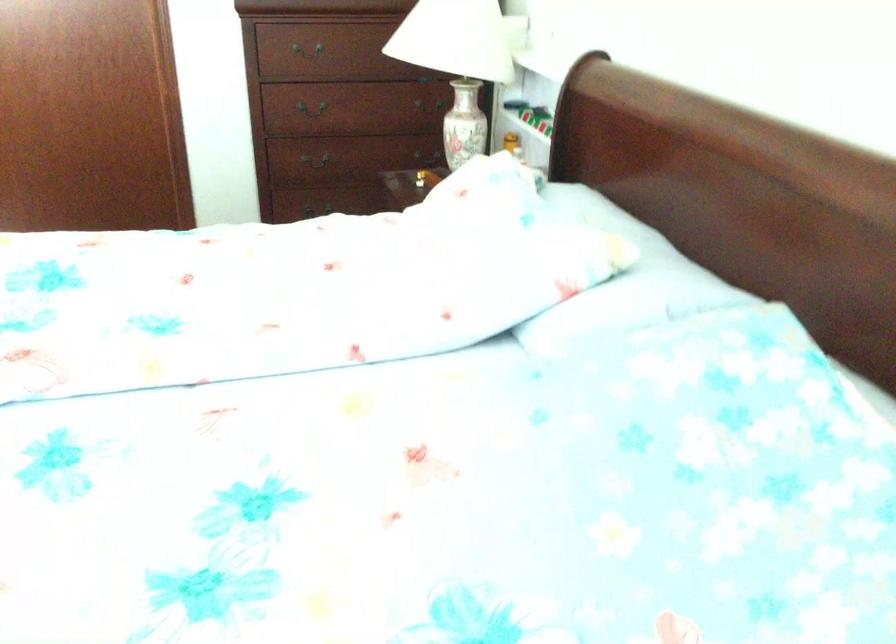
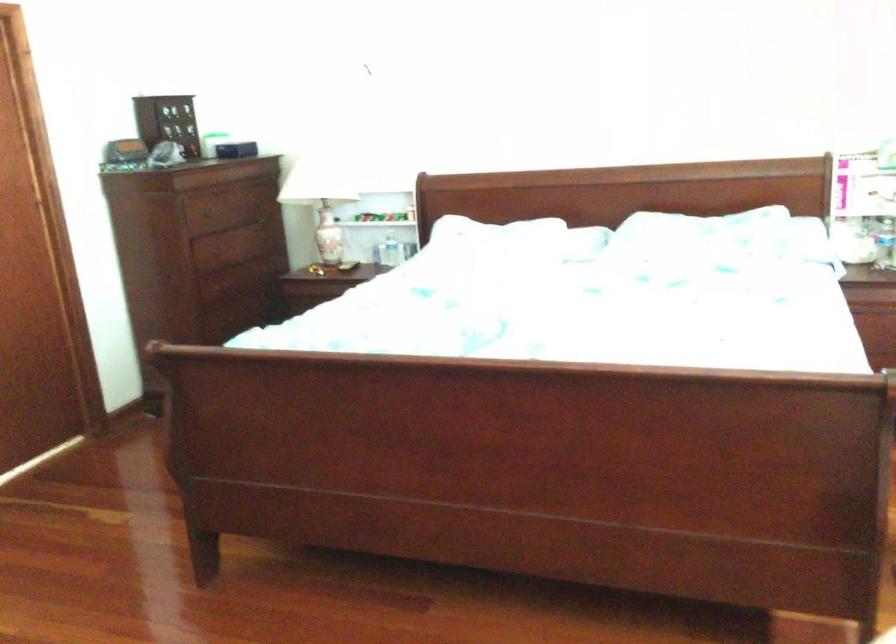
Question: I am providing you with two images of the same scene from different viewpoints. Which of the following objects are not visible in image2?

Choices:
 (A) metal drawer handle
 (B) plastic water bottle
 (C) beige appliance handle
 (D) small blue box

Answer: (A)